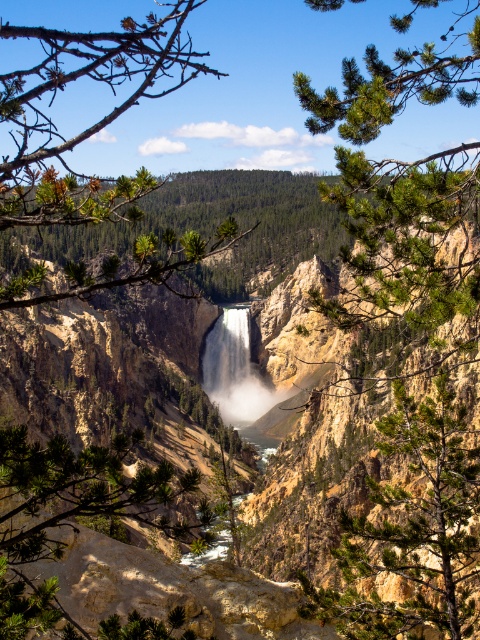
Between point (195, 259) and point (233, 330), which one is positioned behind?

Point (233, 330)

Is green needle-like leaves at center positioned at the back of white misty waterfall at center?

That is False.

Between point (122, 52) and point (245, 390), which one is positioned in front?

Positioned in front is point (122, 52).

Image resolution: width=480 pixels, height=640 pixels. Identify the location of green needle-like leaves at center. (94, 122).

Does green needle-like leaves at center come behind green textured tree at center?

That is False.

What do you see at coordinates (94, 122) in the screenshot?
I see `green needle-like leaves at center` at bounding box center [94, 122].

Where is `green needle-like leaves at center`? This screenshot has width=480, height=640. green needle-like leaves at center is located at coordinates (94, 122).

Is green textured tree at center positioned at the back of white misty waterfall at center?

No, green textured tree at center is closer to the viewer.

Between green textured tree at center and white misty waterfall at center, which one is positioned higher?

white misty waterfall at center is higher up.

I want to click on green textured tree at center, so click(x=411, y=531).